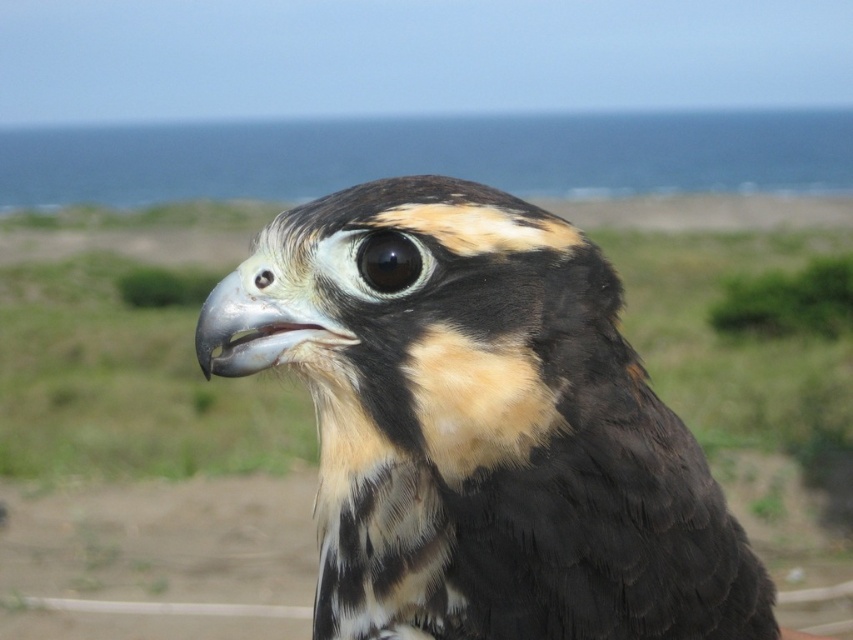
Question: Which object appears farthest from the camera in this image?

Choices:
 (A) black glossy eye at center
 (B) black glossy eye at upper center
 (C) black feathered eagle at center

Answer: (B)

Question: Is black glossy eye at center to the left of black glossy eye at upper center from the viewer's perspective?

Choices:
 (A) yes
 (B) no

Answer: (B)

Question: Does black glossy eye at center have a greater width compared to black glossy eye at upper center?

Choices:
 (A) yes
 (B) no

Answer: (A)

Question: Estimate the real-world distances between objects in this image. Which object is farther from the black glossy eye at center?

Choices:
 (A) black feathered eagle at center
 (B) black glossy eye at upper center

Answer: (A)

Question: Which is farther from the black glossy eye at upper center?

Choices:
 (A) black glossy eye at center
 (B) black feathered eagle at center

Answer: (B)

Question: Does black feathered eagle at center have a lesser width compared to black glossy eye at center?

Choices:
 (A) yes
 (B) no

Answer: (B)